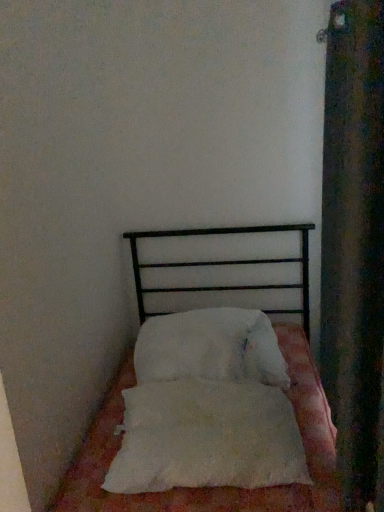
Question: Is white fluffy pillow at center, which ranks as the first pillow in back-to-front order, at the left side of white soft bed at center?

Choices:
 (A) no
 (B) yes

Answer: (A)

Question: Does white fluffy pillow at center, which ranks as the first pillow in back-to-front order, have a smaller size compared to white soft bed at center?

Choices:
 (A) no
 (B) yes

Answer: (B)

Question: Are white fluffy pillow at center, arranged as the second pillow when viewed from the front, and white soft bed at center located far from each other?

Choices:
 (A) yes
 (B) no

Answer: (B)

Question: From a real-world perspective, is white fluffy pillow at center, which ranks as the first pillow in back-to-front order, located higher than white soft bed at center?

Choices:
 (A) no
 (B) yes

Answer: (B)

Question: Is white fluffy pillow at center, arranged as the second pillow when viewed from the front, facing towards white soft bed at center?

Choices:
 (A) no
 (B) yes

Answer: (B)

Question: Is white fluffy pillow at center, which ranks as the first pillow in back-to-front order, behind white soft bed at center?

Choices:
 (A) no
 (B) yes

Answer: (B)

Question: Is the position of velvet dark green curtain at right less distant than that of white fluffy pillow at center, positioned as the second pillow in back-to-front order?

Choices:
 (A) no
 (B) yes

Answer: (B)

Question: Can you confirm if velvet dark green curtain at right is smaller than white fluffy pillow at center, which is counted as the first pillow, starting from the front?

Choices:
 (A) no
 (B) yes

Answer: (A)

Question: Is velvet dark green curtain at right located outside white fluffy pillow at center, positioned as the second pillow in back-to-front order?

Choices:
 (A) no
 (B) yes

Answer: (B)

Question: Is velvet dark green curtain at right at the left side of white fluffy pillow at center, positioned as the second pillow in back-to-front order?

Choices:
 (A) no
 (B) yes

Answer: (A)

Question: From the image's perspective, is velvet dark green curtain at right located beneath white fluffy pillow at center, which is counted as the first pillow, starting from the front?

Choices:
 (A) no
 (B) yes

Answer: (A)

Question: Is velvet dark green curtain at right wider than white fluffy pillow at center, which is counted as the first pillow, starting from the front?

Choices:
 (A) yes
 (B) no

Answer: (B)

Question: Is white fluffy pillow at center, arranged as the second pillow when viewed from the front, far from white fluffy pillow at center, which is counted as the first pillow, starting from the front?

Choices:
 (A) yes
 (B) no

Answer: (B)